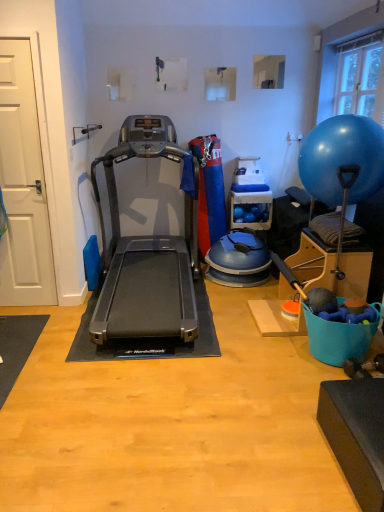
Question: Considering the positions of transparent glass window at upper right and blue rubber ball at right in the image, is transparent glass window at upper right taller or shorter than blue rubber ball at right?

Choices:
 (A) short
 (B) tall

Answer: (A)

Question: Relative to blue rubber ball at right, is transparent glass window at upper right in front or behind?

Choices:
 (A) behind
 (B) front

Answer: (A)

Question: Based on their relative distances, which object is nearer to the black rubber treadmill at center?

Choices:
 (A) transparent glass window at upper right
 (B) blue rubber ball at right
 (C) white matte door at left

Answer: (C)

Question: Which object is positioned closest to the white matte door at left?

Choices:
 (A) transparent glass window at upper right
 (B) blue rubber ball at right
 (C) black rubber treadmill at center

Answer: (C)